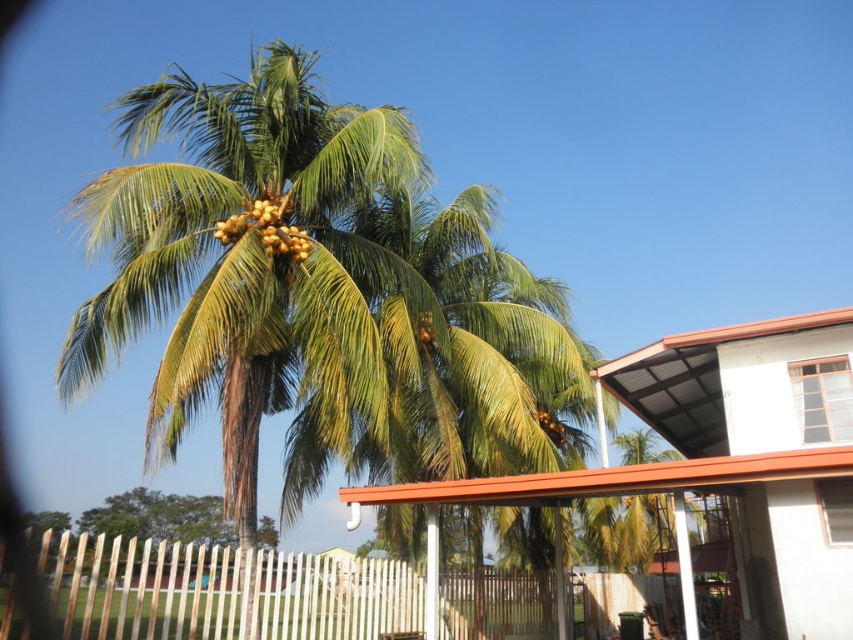
You are a gardener who needs to prune the green leafy palm at lower left and the yellow matte coconuts at upper center. Which one should you tackle first if you want to start with the taller one?

The green leafy palm at lower left has a greater height compared to the yellow matte coconuts at upper center, so you should prune the green leafy palm at lower left first.

You are standing at the center of the image and want to reach the green leafy palm at lower left. Which direction should you move to reach it?

You should move to the lower left direction to reach the green leafy palm at lower left since it is located at point (160,516).

You are a farmer checking the coconut trees in the tropical setting. You see the green leafy coconut tree at center and the yellow matte coconuts at upper center. Which object is located higher in the image?

The yellow matte coconuts at upper center are located higher in the image than the green leafy coconut tree at center.